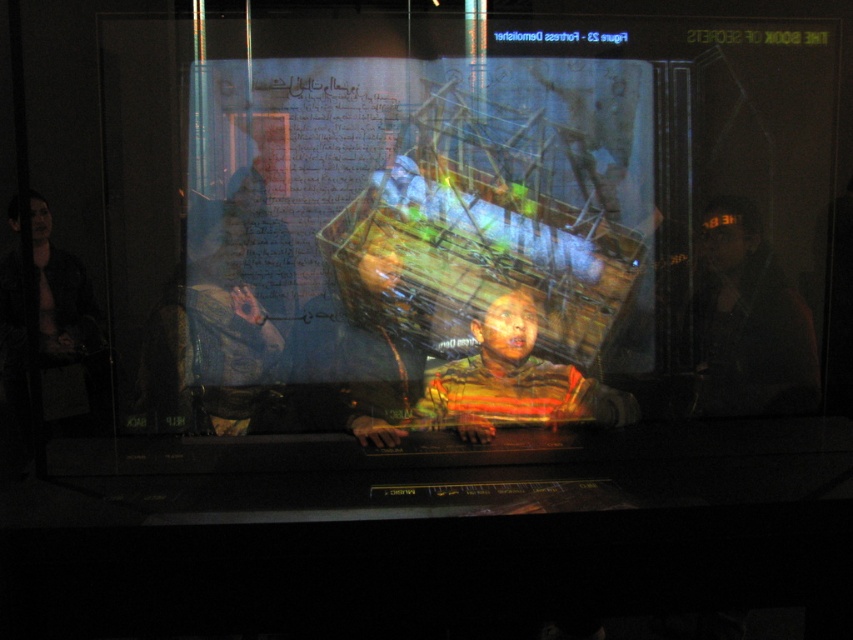
You are a visitor in the museum and see the projected image in the display case. There is a dark hair at point (749,323). What is located at that point?

At point (749,323) lies dark hair at right.

You are a museum visitor standing in front of the display case. You notice a point marked at coordinates (x=514, y=381) in the projected image. Which object in the scene does this point belong to?

The point at coordinates (x=514, y=381) is on the striped fabric child at center.